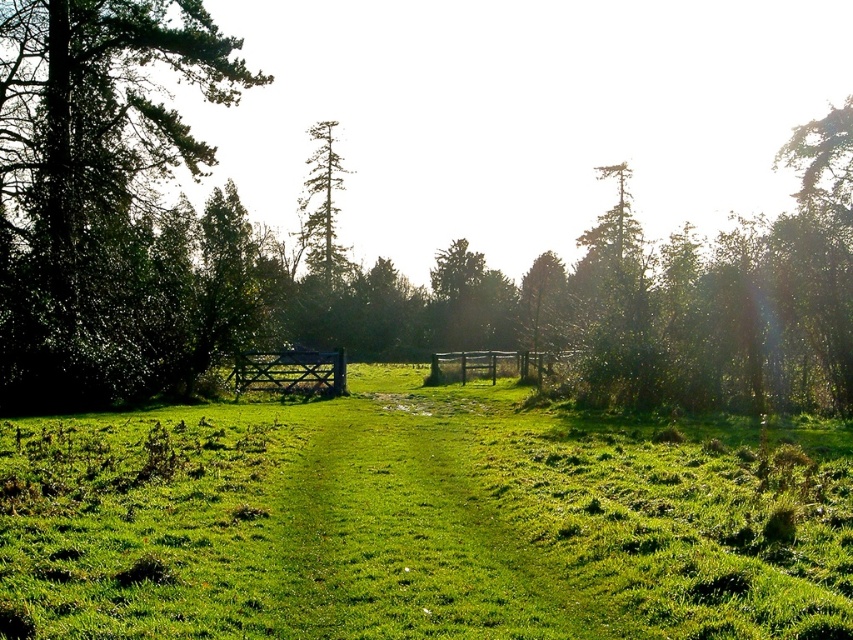
You are standing at the edge of the green grassy pasture at center and want to walk towards the green leafy tree at left. Which direction should you face to walk directly towards the tree?

You should face towards the left direction to walk directly towards the green leafy tree at left from the green grassy pasture at center.

You are a gardener standing in the field and want to plant a new flower bed. The green leafy tree at left and the wooden fence at center are in your way. Which object is blocking your view of the sky?

The green leafy tree at left is above the wooden fence at center, so the green leafy tree at left is blocking your view of the sky.